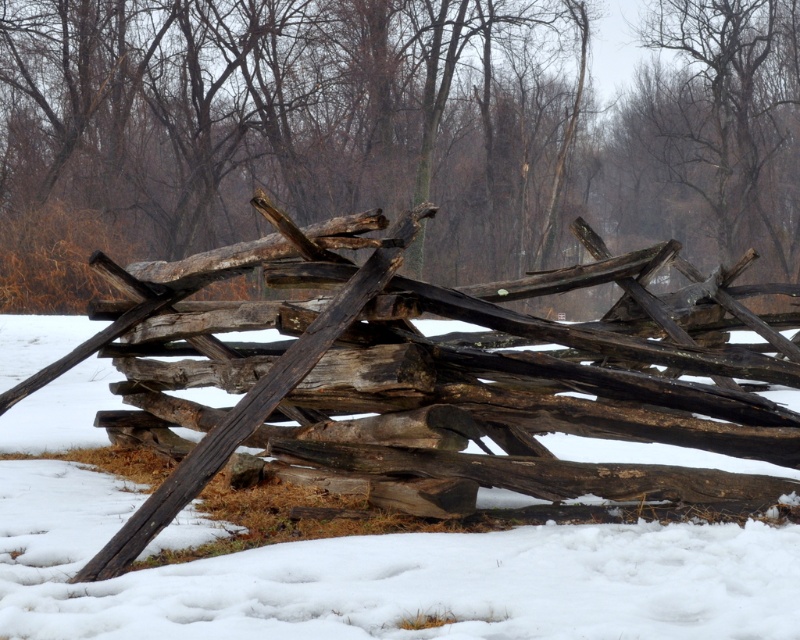
Which is behind, point (428, 246) or point (0, 628)?

The point (428, 246) is more distant.

Is weathered wood fence at center below white powdery snow at center?

No.

Locate an element on the screen. weathered wood fence at center is located at coordinates (384, 129).

Locate an element on the screen. Image resolution: width=800 pixels, height=640 pixels. weathered wood fence at center is located at coordinates (384, 129).

Who is lower down, white powdery snow at center or brown textured wood at upper center?

white powdery snow at center

Is white powdery snow at center above brown textured wood at upper center?

Actually, white powdery snow at center is below brown textured wood at upper center.

Is point (78, 330) farther from viewer compared to point (692, 109)?

No, (78, 330) is in front of (692, 109).

The image size is (800, 640). What are the coordinates of `white powdery snow at center` in the screenshot? It's located at (388, 577).

How distant is weathered wood fence at center from brown textured wood at upper center?

10.07 meters

Who is positioned more to the right, weathered wood fence at center or brown textured wood at upper center?

brown textured wood at upper center

Between point (176, 156) and point (634, 100), which one is positioned in front?

Point (176, 156)

The width and height of the screenshot is (800, 640). In order to click on weathered wood fence at center in this screenshot , I will do `click(384, 129)`.